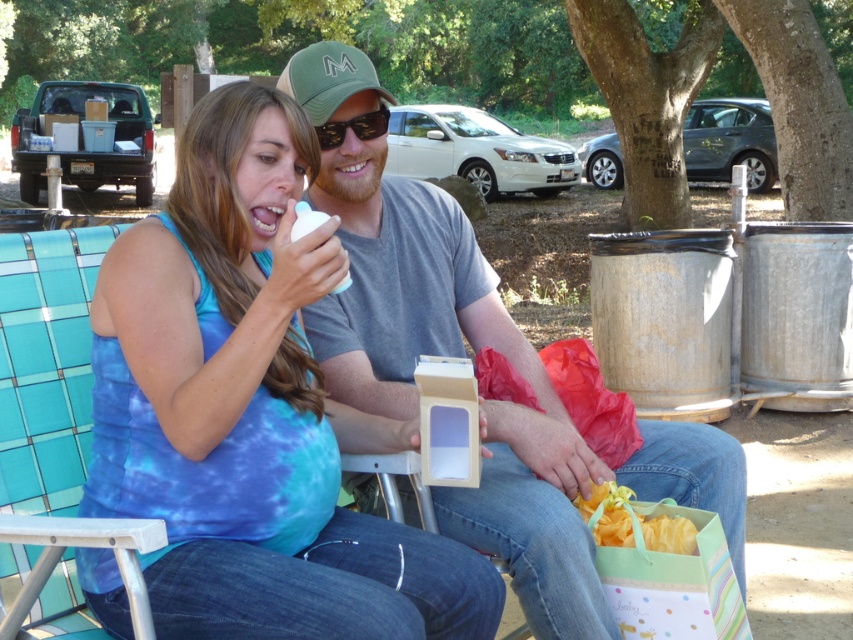
Question: Observing the image, what is the correct spatial positioning of blue tie-dye tank top at center in reference to matte gray shirt at center?

Choices:
 (A) left
 (B) right

Answer: (A)

Question: Considering the relative positions of yellow silky ribbon at lower center and sunglasses at center in the image provided, where is yellow silky ribbon at lower center located with respect to sunglasses at center?

Choices:
 (A) below
 (B) above

Answer: (A)

Question: Which point is closer to the camera taking this photo?

Choices:
 (A) (264, 525)
 (B) (622, 528)
 (C) (351, 128)

Answer: (A)

Question: Is blue tie-dye tank top at center to the right of matte gray shirt at center from the viewer's perspective?

Choices:
 (A) yes
 (B) no

Answer: (B)

Question: Which of the following is the closest to the observer?

Choices:
 (A) (328, 304)
 (B) (254, 160)
 (C) (387, 128)
 (D) (622, 544)

Answer: (B)

Question: Which object is positioned farthest from the blue tie-dye tank top at center?

Choices:
 (A) yellow silky ribbon at lower center
 (B) sunglasses at center
 (C) matte gray shirt at center

Answer: (A)